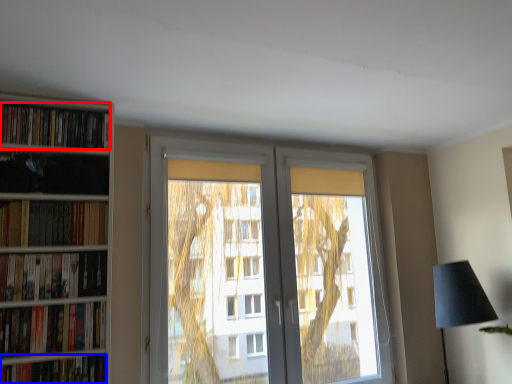
Question: Which object is further to the camera taking this photo, book (highlighted by a red box) or book (highlighted by a blue box)?

Choices:
 (A) book
 (B) book

Answer: (A)